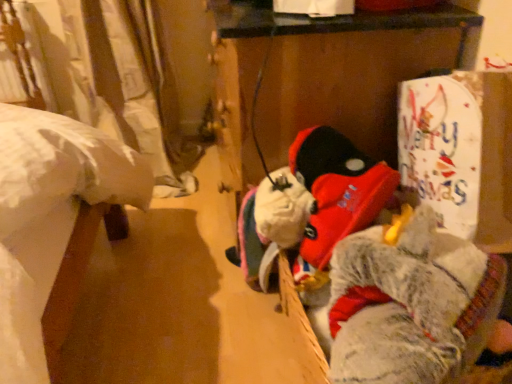
Question: Considering their positions, is white paper sign at upper right located in front of or behind fuzzy gray stuffed animal at right?

Choices:
 (A) behind
 (B) front

Answer: (A)

Question: In terms of size, does white paper sign at upper right appear bigger or smaller than fuzzy gray stuffed animal at right?

Choices:
 (A) big
 (B) small

Answer: (B)

Question: Does point (490, 109) appear closer or farther from the camera than point (426, 238)?

Choices:
 (A) closer
 (B) farther

Answer: (B)

Question: Based on their sizes in the image, would you say fuzzy gray stuffed animal at right is bigger or smaller than white paper sign at upper right?

Choices:
 (A) small
 (B) big

Answer: (B)

Question: Is fuzzy gray stuffed animal at right taller or shorter than white paper sign at upper right?

Choices:
 (A) short
 (B) tall

Answer: (B)

Question: In the image, is fuzzy gray stuffed animal at right on the left side or the right side of white paper sign at upper right?

Choices:
 (A) left
 (B) right

Answer: (A)

Question: From the image's perspective, is fuzzy gray stuffed animal at right above or below white paper sign at upper right?

Choices:
 (A) above
 (B) below

Answer: (B)